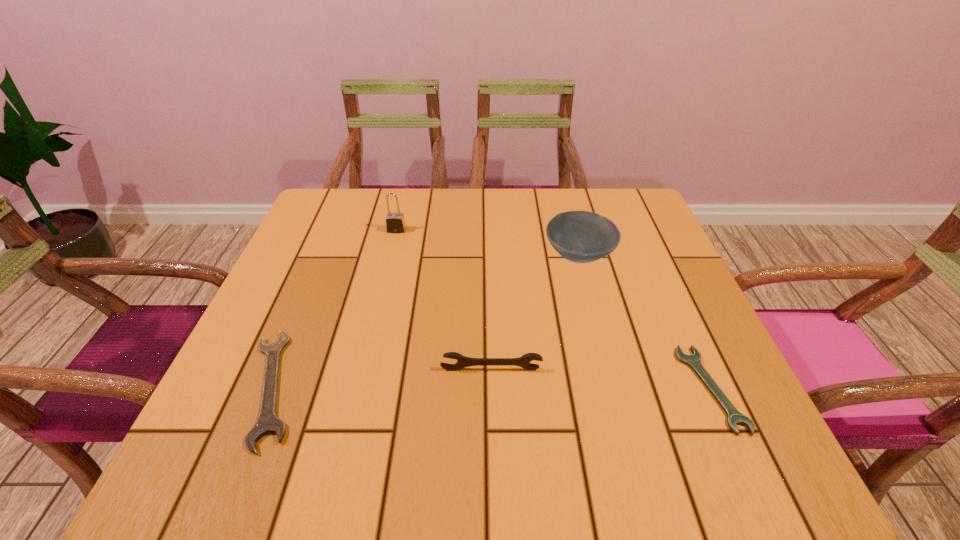
The height and width of the screenshot is (540, 960). Find the location of `object that is at the near left corner`. object that is at the near left corner is located at coordinates (267, 422).

Locate an element on the screen. The height and width of the screenshot is (540, 960). object that is at the far right corner is located at coordinates (578, 236).

I want to click on object located at the near right corner, so click(x=734, y=417).

Where is `vacant region at the far edge of the desktop`? The height and width of the screenshot is (540, 960). vacant region at the far edge of the desktop is located at coordinates coord(455,210).

Locate an element on the screen. vacant area at the near edge of the desktop is located at coordinates (349, 427).

This screenshot has height=540, width=960. What are the coordinates of `free region at the left edge of the desktop` in the screenshot? It's located at (324, 259).

Where is `free location at the far left corner`? free location at the far left corner is located at coordinates (314, 215).

In the image, there is a desktop. Identify the location of free space at the far right corner. (603, 196).

Identify the location of vacant space at the near right corner of the desktop. The image size is (960, 540). (747, 467).

The image size is (960, 540). What are the coordinates of `free space between the second object from left to right and the tallest wrench` in the screenshot? It's located at (444, 300).